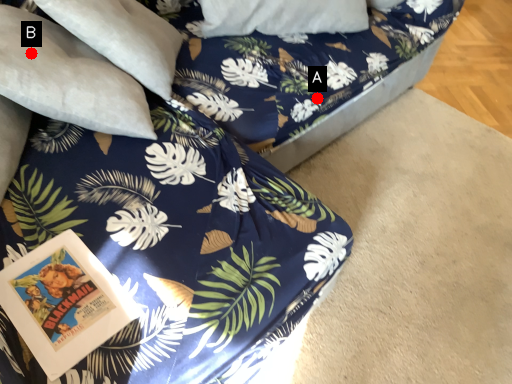
Question: Two points are circled on the image, labeled by A and B beside each circle. Which of the following is the farthest from the observer?

Choices:
 (A) A is further
 (B) B is further

Answer: (A)